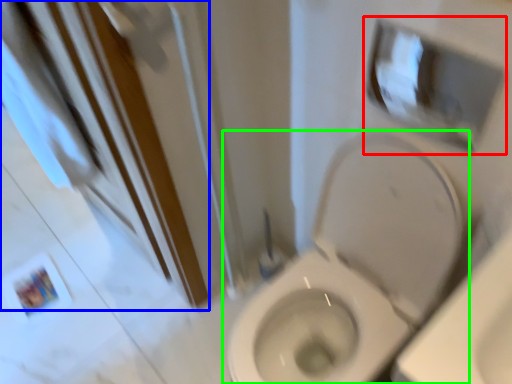
Question: Considering the real-world distances, which object is farthest from medicine cabinet (highlighted by a red box)? screen door (highlighted by a blue box) or toilet (highlighted by a green box)?

Choices:
 (A) screen door
 (B) toilet

Answer: (A)